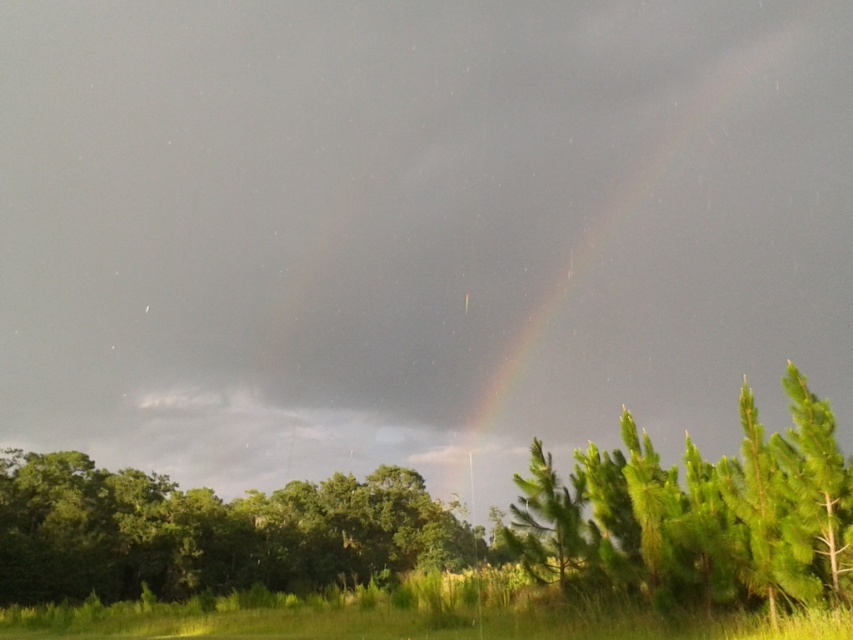
Is rainbow at upper right positioned at the back of green leafy tree at lower center?

Yes, it is behind green leafy tree at lower center.

Does rainbow at upper right have a lesser height compared to green leafy tree at lower center?

No, rainbow at upper right is not shorter than green leafy tree at lower center.

Does point (648, 256) come closer to viewer compared to point (68, 600)?

No.

This screenshot has width=853, height=640. I want to click on rainbow at upper right, so click(699, 262).

Who is more distant from viewer, (x=845, y=282) or (x=741, y=387)?

The point (x=741, y=387) is more distant.

Can you confirm if rainbow at upper right is shorter than green needle-like at center?

In fact, rainbow at upper right may be taller than green needle-like at center.

Does point (653, 202) come closer to viewer compared to point (701, 556)?

No, (653, 202) is behind (701, 556).

I want to click on rainbow at upper right, so click(x=699, y=262).

In the scene shown: Can you confirm if green needle-like at center is wider than green leafy tree at lower center?

Correct, the width of green needle-like at center exceeds that of green leafy tree at lower center.

Between green needle-like at center and green leafy tree at lower center, which one is positioned higher?

Positioned higher is green needle-like at center.

This screenshot has width=853, height=640. Find the location of `green needle-like at center`. green needle-like at center is located at coordinates (698, 515).